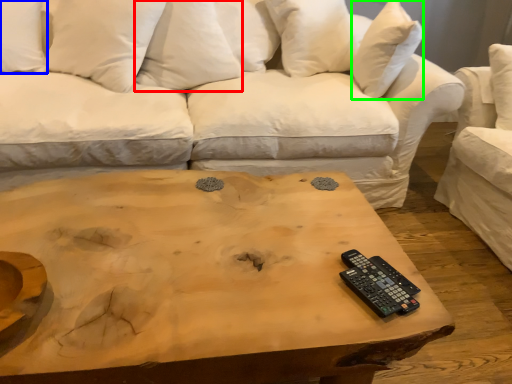
Question: Based on their relative distances, which object is nearer to pillow (highlighted by a red box)? Choose from pillow (highlighted by a blue box) and pillow (highlighted by a green box).

Choices:
 (A) pillow
 (B) pillow

Answer: (A)